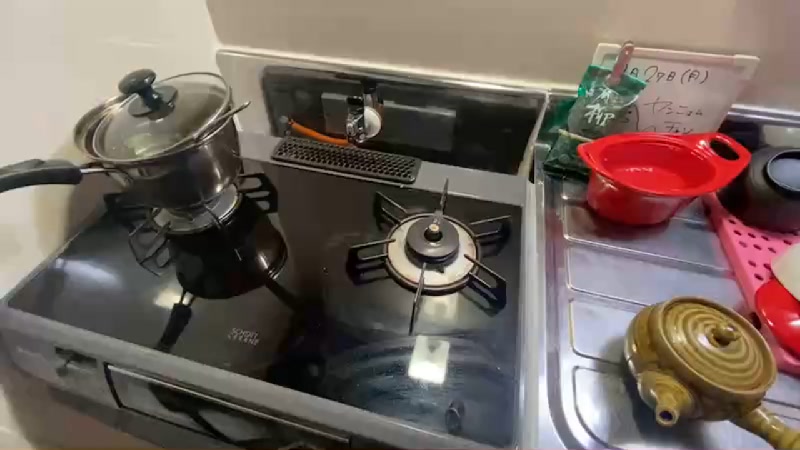
The height and width of the screenshot is (450, 800). I want to click on light brown wall, so 496,37.